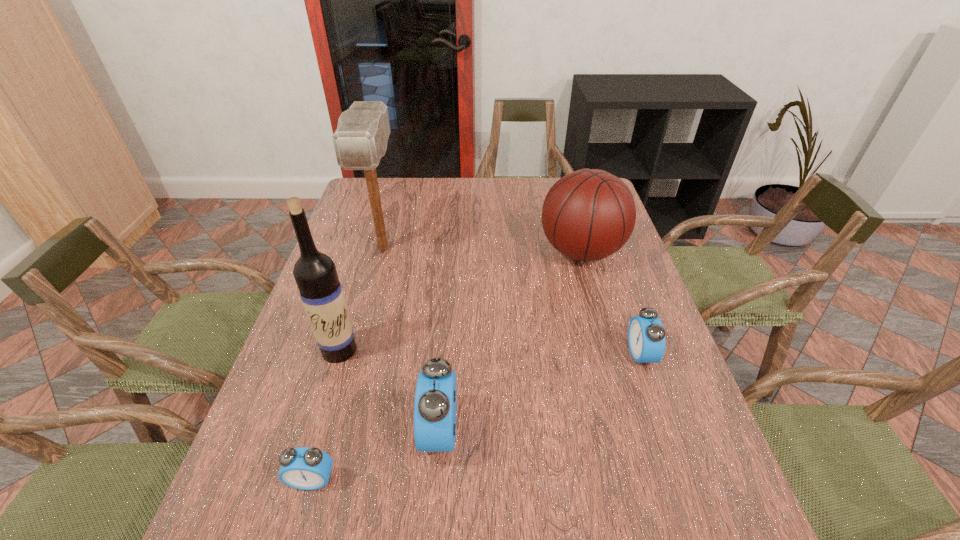
Please mark a free spot for a new alarm_clock to balance the arrangement. Please provide its 2D coordinates. Your answer should be formatted as a tuple, i.e. [(x, y)], where the tuple contains the x and y coordinates of a point satisfying the conditions above.

[(548, 390)]